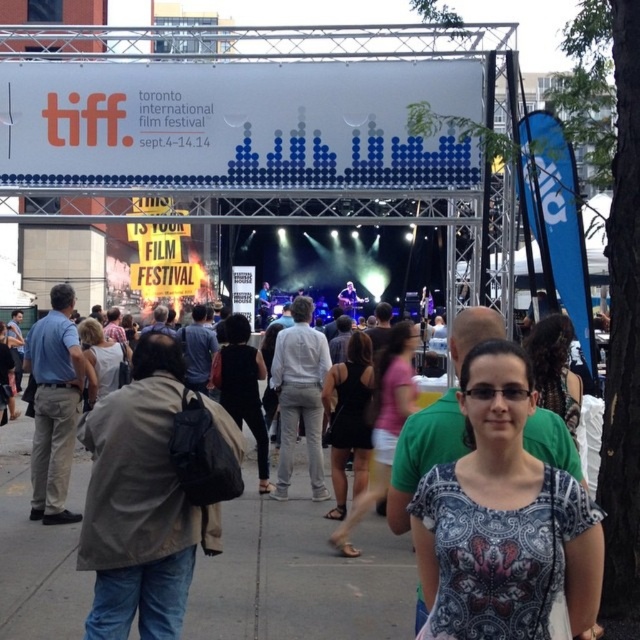
Question: Is black dress at center bigger than matte black dress at center?

Choices:
 (A) yes
 (B) no

Answer: (B)

Question: Which point is closer to the camera?

Choices:
 (A) matte black sunglasses at center
 (B) matte black dress at center
 (C) black dress at center

Answer: (A)

Question: Is black dress at center behind matte black dress at center?

Choices:
 (A) yes
 (B) no

Answer: (B)

Question: Is blue printed blouse at center further to camera compared to black dress at center?

Choices:
 (A) yes
 (B) no

Answer: (B)

Question: Which of the following is the closest to the observer?

Choices:
 (A) white cotton shirt at center
 (B) matte black tank top at center
 (C) black cotton dress at center
 (D) matte black dress at center

Answer: (A)

Question: Which object is farther from the camera taking this photo?

Choices:
 (A) matte black tank top at center
 (B) black cotton dress at center
 (C) matte black sunglasses at center
 (D) blue printed blouse at center

Answer: (B)